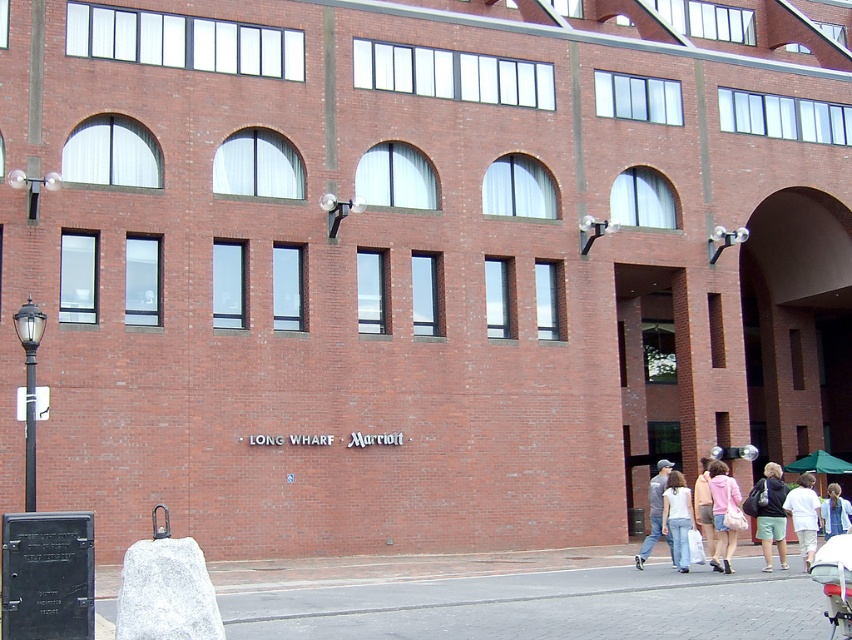
Question: From the image, what is the correct spatial relationship of black metal plaque at lower left in relation to black metal pole at left?

Choices:
 (A) left
 (B) right

Answer: (B)

Question: Which point is farther to the camera?

Choices:
 (A) white cotton tank top at lower center
 (B) light blue denim jeans at lower right
 (C) black polished metal streetlamp at left

Answer: (B)

Question: Does black polished metal streetlamp at left appear on the left side of pink fabric jacket at lower right?

Choices:
 (A) yes
 (B) no

Answer: (A)

Question: Estimate the real-world distances between objects in this image. Which object is closer to the white cotton tank top at lower center?

Choices:
 (A) brick pavement at lower center
 (B) denim jacket at lower right
 (C) black polished metal streetlamp at left

Answer: (B)

Question: Based on their relative distances, which object is nearer to the brick pavement at lower center?

Choices:
 (A) black metal pole at left
 (B) denim jacket at lower right
 (C) light pink fabric jacket at lower right
 (D) light blue denim jeans at lower right

Answer: (C)

Question: Is brick pavement at lower center below pink fabric jacket at lower right?

Choices:
 (A) yes
 (B) no

Answer: (A)